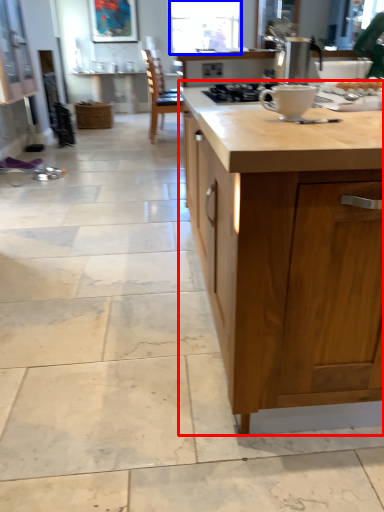
Question: Which of the following is the farthest to the observer, countertop (highlighted by a red box) or window screen (highlighted by a blue box)?

Choices:
 (A) countertop
 (B) window screen

Answer: (B)